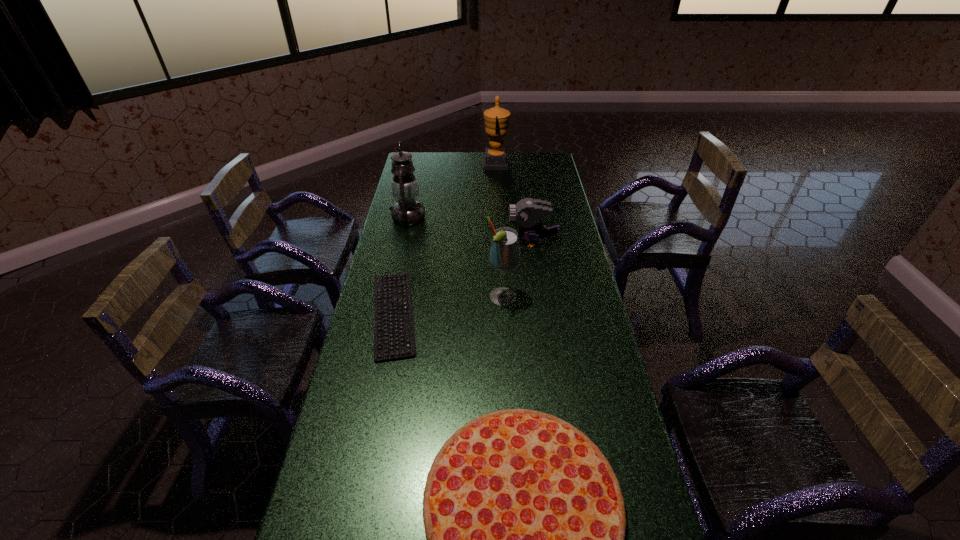
Find the location of a particular element. The width and height of the screenshot is (960, 540). vacant space situated 0.320m on the back of the alcohol is located at coordinates (499, 235).

What are the coordinates of `free space located 0.190m at the beak of the third farthest object` in the screenshot? It's located at (463, 242).

Where is `free space located 0.370m at the beak of the third farthest object`? This screenshot has height=540, width=960. free space located 0.370m at the beak of the third farthest object is located at coordinates (420, 242).

Where is `free space located 0.250m at the beak of the third farthest object`? The width and height of the screenshot is (960, 540). free space located 0.250m at the beak of the third farthest object is located at coordinates (448, 242).

Image resolution: width=960 pixels, height=540 pixels. What are the coordinates of `vacant region located on the back of the shortest object` in the screenshot? It's located at (403, 266).

The image size is (960, 540). I want to click on object that is positioned at the far edge, so click(x=496, y=119).

Locate an element on the screen. oil lamp at the left edge is located at coordinates (407, 211).

Find the location of a particular element. The image size is (960, 540). computer keyboard that is at the left edge is located at coordinates (382, 306).

Where is `object located in the right edge section of the desktop`? object located in the right edge section of the desktop is located at coordinates (527, 212).

In the image, there is a desktop. Identify the location of vacant space at the left edge. Image resolution: width=960 pixels, height=540 pixels. (340, 409).